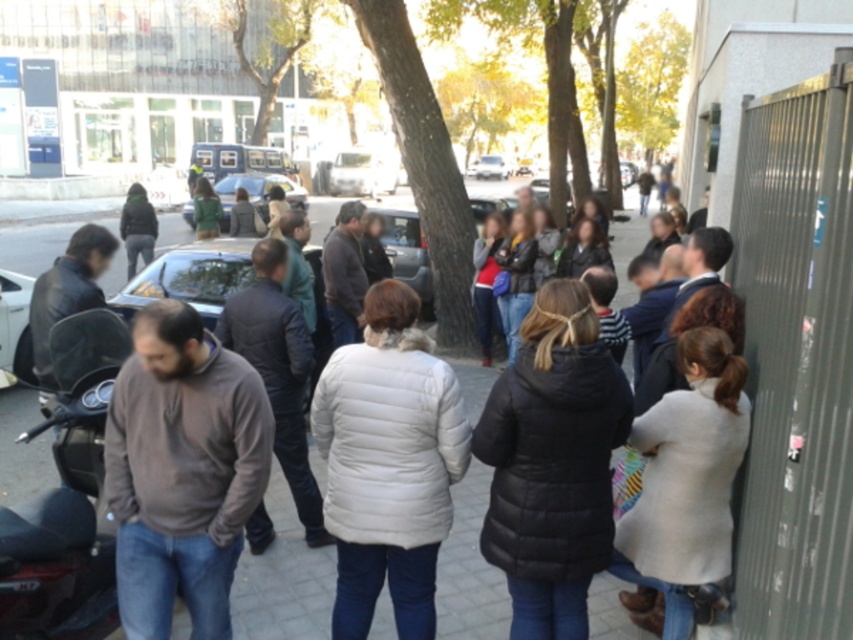
You are a delivery driver who needs to park your vehicle in this area. You have a white glossy car at left and a metallic silver van at center. Is there enough space between them to fit your delivery van which is 12 meters long?

The distance between the white glossy car at left and the metallic silver van at center is 32.43 meters. Since your delivery van is 12 meters long, there is sufficient space between them to park your vehicle.